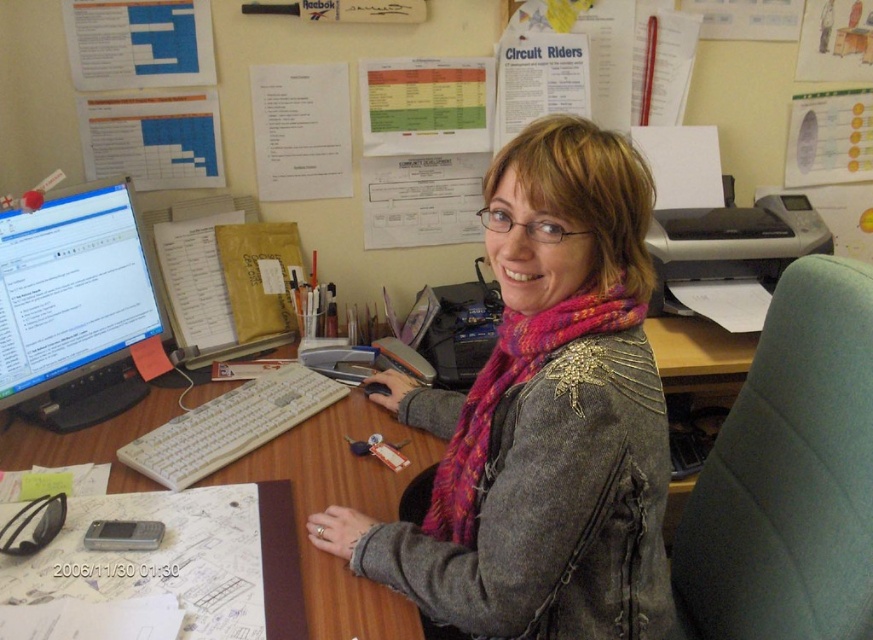
You are organizing the desk and need to move items from the green fabric swivel chair at right to the white plastic keyboard at center. Which direction should you move the items?

The green fabric swivel chair at right is located below the white plastic keyboard at center, so you should move the items upward to reach the white plastic keyboard at center.

You are organizing a small party and need to move the green fabric swivel chair at right and the black glossy monitor at left to make space. Which object should you move first to ensure you can access the other one easily?

The green fabric swivel chair at right is closer to the viewer than the black glossy monitor at left, so you should move the green fabric swivel chair at right first to access the black glossy monitor at left easily.

You are standing in the workspace shown in the image. You need to determine if a 12 inch ruler can reach from your current position to the point at coordinates point (858,413). Can it?

The point (858,413) is 36.50 inches away from the camera, so a 12 inch ruler cannot reach that distance. You would need a longer measuring tool.